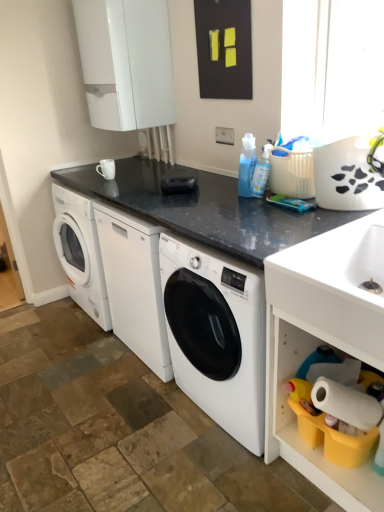
This screenshot has height=512, width=384. Find the location of `vacant space behind blue glossy bottle at center`. vacant space behind blue glossy bottle at center is located at coordinates (224, 186).